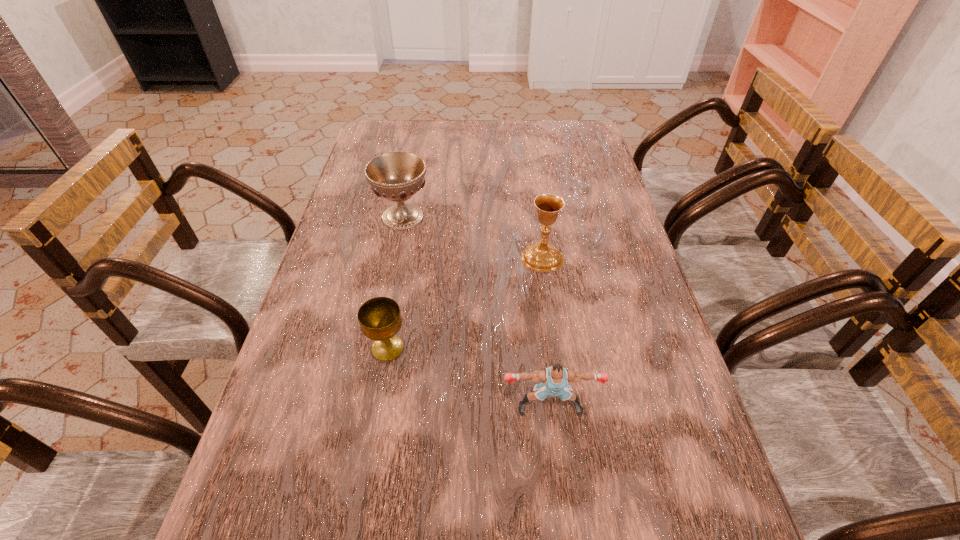
Identify the location of object at the left edge. (397, 176).

Identify the location of free region at the far edge of the desktop. Image resolution: width=960 pixels, height=540 pixels. (421, 147).

You are a GUI agent. You are given a task and a screenshot of the screen. Output one action in this format:
    pyautogui.click(x=<x>, y=<y>)
    Task: Click on the free space at the left edge of the desktop
    The height and width of the screenshot is (540, 960).
    Given the screenshot: What is the action you would take?
    pyautogui.click(x=246, y=511)

You are a GUI agent. You are given a task and a screenshot of the screen. Output one action in this format:
    pyautogui.click(x=<x>, y=<y>)
    Task: Click on the free point at the right edge
    The height and width of the screenshot is (540, 960).
    Given the screenshot: What is the action you would take?
    pyautogui.click(x=586, y=193)

Identify the location of free space at the far left corner of the desktop. This screenshot has width=960, height=540. (404, 137).

This screenshot has width=960, height=540. Identify the location of vacant point at the far right corner. (583, 123).

The width and height of the screenshot is (960, 540). I want to click on free spot between the nearest object and the farthest object, so click(x=476, y=312).

This screenshot has height=540, width=960. I want to click on vacant region between the farthest chalice and the second nearest chalice, so click(x=472, y=237).

Identify the location of vacant point located between the puncher and the farthest object. (476, 312).

This screenshot has width=960, height=540. What are the coordinates of `free space between the farthest chalice and the nearest chalice` in the screenshot? It's located at (396, 282).